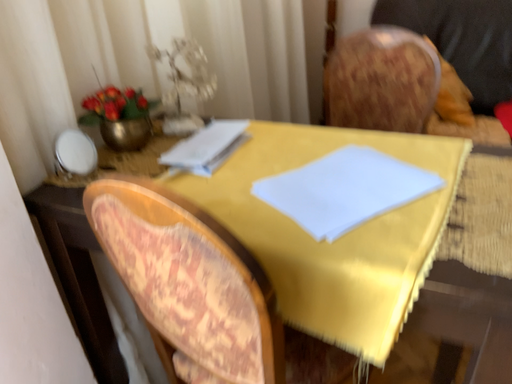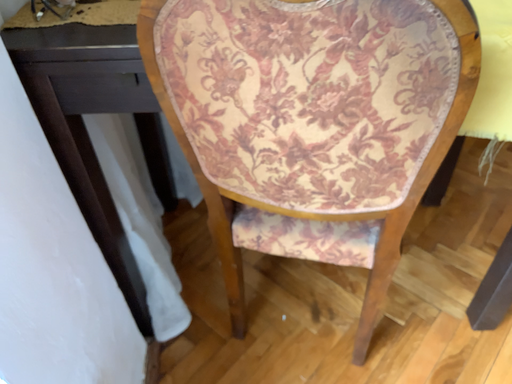
Question: Which way did the camera rotate in the video?

Choices:
 (A) rotated left
 (B) rotated right

Answer: (B)